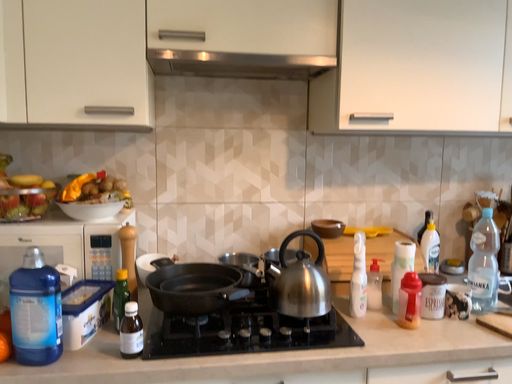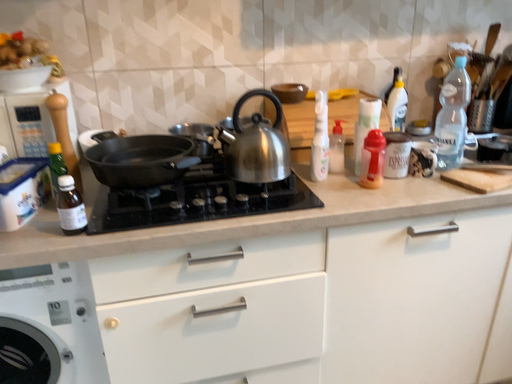
Question: How did the camera likely rotate when shooting the video?

Choices:
 (A) rotated downward
 (B) rotated upward

Answer: (A)